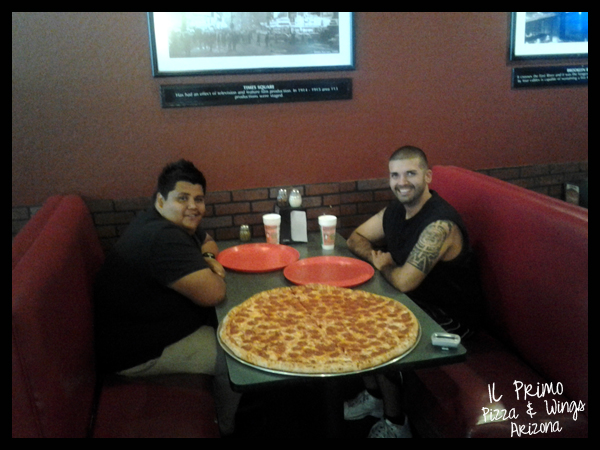
The height and width of the screenshot is (450, 600). In order to click on cups in this screenshot , I will do `click(271, 228)`, `click(327, 226)`.